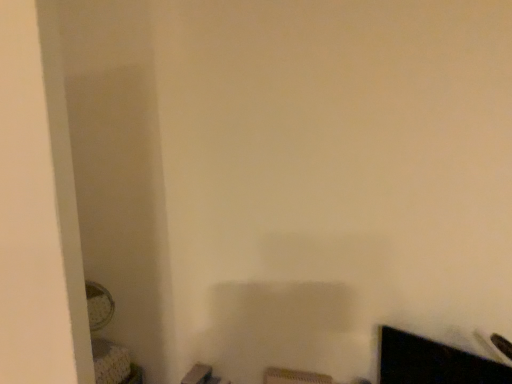
This screenshot has height=384, width=512. What do you see at coordinates (432, 362) in the screenshot?
I see `black glossy monitor at bottom right` at bounding box center [432, 362].

Where is `black glossy monitor at bottom right`? black glossy monitor at bottom right is located at coordinates (432, 362).

You are a GUI agent. You are given a task and a screenshot of the screen. Output one action in this format:
    pyautogui.click(x=<x>, y=<y>)
    Task: Click on the black glossy monitor at bottom right
    The height and width of the screenshot is (384, 512).
    Given the screenshot: What is the action you would take?
    pyautogui.click(x=432, y=362)